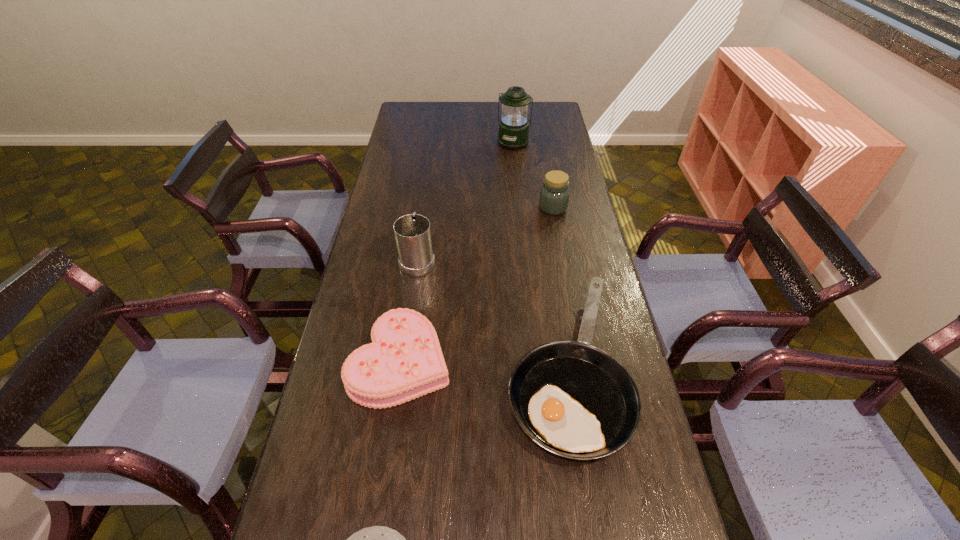
The height and width of the screenshot is (540, 960). Identify the location of blank region between the frying pan and the jar. (560, 287).

Select which object is the second closest to the nearest object. Please provide its 2D coordinates. Your answer should be formatted as a tuple, i.e. [(x, y)], where the tuple contains the x and y coordinates of a point satisfying the conditions above.

[(404, 361)]

Identify which object is located as the second nearest to the tallest object. Please provide its 2D coordinates. Your answer should be formatted as a tuple, i.e. [(x, y)], where the tuple contains the x and y coordinates of a point satisfying the conditions above.

[(412, 232)]

Find the location of `vacant space that satisfies the following two spatial constraints: 1. on the back side of the jar; 2. on the left side of the cake`. vacant space that satisfies the following two spatial constraints: 1. on the back side of the jar; 2. on the left side of the cake is located at coordinates (423, 208).

Find the location of a particular element. This screenshot has height=540, width=960. free space that satisfies the following two spatial constraints: 1. on the side of the third farthest object with the handle; 2. on the left side of the third tallest object is located at coordinates pyautogui.click(x=425, y=208).

The height and width of the screenshot is (540, 960). Find the location of `free space that satisfies the following two spatial constraints: 1. on the back side of the cake; 2. on the right side of the third tallest object`. free space that satisfies the following two spatial constraints: 1. on the back side of the cake; 2. on the right side of the third tallest object is located at coordinates [x=423, y=208].

Identify the location of vacant point that satisfies the following two spatial constraints: 1. on the back side of the cake; 2. on the right side of the third tallest object. (423, 208).